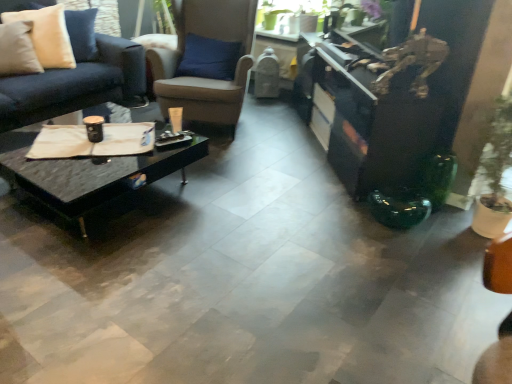
Describe the element at coordinates (47, 35) in the screenshot. The width and height of the screenshot is (512, 384). I see `beige fabric pillow at upper left` at that location.

Consider the image. Measure the distance between brown leather chair at center and camera.

The distance of brown leather chair at center from camera is 3.07 meters.

Identify the location of black glossy entertainment center at right. (373, 109).

At what (x,y) coordinates should I click in order to perform the action: click on black marble coffee table at center. Please return your answer as a coordinate pair (x, y). This screenshot has height=384, width=512. Looking at the image, I should click on (94, 176).

Does black glossy entertainment center at right have a smaller size compared to beige fabric pillow at upper left?

No.

Could you tell me if black glossy entertainment center at right is turned towards beige fabric pillow at upper left?

Yes, black glossy entertainment center at right is turned towards beige fabric pillow at upper left.

Measure the distance from black glossy entertainment center at right to beige fabric pillow at upper left.

The distance of black glossy entertainment center at right from beige fabric pillow at upper left is 2.26 meters.

Which of these two, black glossy entertainment center at right or beige fabric pillow at upper left, stands shorter?

beige fabric pillow at upper left.

Which is further, (219, 111) or (39, 41)?

Point (39, 41)

Find the location of a particular element. This screenshot has height=384, width=512. chair on the right of beige fabric pillow at upper left is located at coordinates (204, 77).

Are brown leather chair at center and beige fabric pillow at upper left making contact?

No, brown leather chair at center is not touching beige fabric pillow at upper left.

Is the position of brown leather chair at center less distant than that of beige fabric pillow at upper left?

Yes, it is in front of beige fabric pillow at upper left.

Is brown leather chair at center situated inside black marble coffee table at center or outside?

brown leather chair at center lies outside black marble coffee table at center.

Is brown leather chair at center bigger or smaller than black marble coffee table at center?

Considering their sizes, brown leather chair at center takes up more space than black marble coffee table at center.

Between brown leather chair at center and black marble coffee table at center, which one has smaller width?

brown leather chair at center.

Which is in front, brown leather chair at center or black marble coffee table at center?

Positioned in front is black marble coffee table at center.

Which is correct: black marble coffee table at center is inside beige fabric pillow at upper left, or outside of it?

black marble coffee table at center cannot be found inside beige fabric pillow at upper left.

Considering the sizes of black marble coffee table at center and beige fabric pillow at upper left in the image, is black marble coffee table at center wider or thinner than beige fabric pillow at upper left?

In the image, black marble coffee table at center appears to be wider than beige fabric pillow at upper left.

Between black marble coffee table at center and beige fabric pillow at upper left, which one appears on the right side from the viewer's perspective?

From the viewer's perspective, black marble coffee table at center appears more on the right side.

Where is `coffee table that appears below the beige fabric pillow at upper left (from a real-world perspective)`? This screenshot has width=512, height=384. coffee table that appears below the beige fabric pillow at upper left (from a real-world perspective) is located at coordinates (94, 176).

Is beige fabric pillow at upper left closer to the viewer compared to brown leather chair at center?

No.

Looking at their sizes, would you say beige fabric pillow at upper left is wider or thinner than brown leather chair at center?

In the image, beige fabric pillow at upper left appears to be more narrow than brown leather chair at center.

Is beige fabric pillow at upper left touching brown leather chair at center?

No.

Does point (5, 17) lie in front of point (401, 153)?

No, it is not.

Could you measure the distance between beige fabric pillow at upper left and black glossy entertainment center at right?

7.41 feet.

How many degrees apart are the facing directions of beige fabric pillow at upper left and black glossy entertainment center at right?

There is a 86.9-degree angle between the facing directions of beige fabric pillow at upper left and black glossy entertainment center at right.

From the picture: From the image's perspective, is beige fabric pillow at upper left beneath black glossy entertainment center at right?

Actually, beige fabric pillow at upper left appears above black glossy entertainment center at right in the image.

From a real-world perspective, which object rests below the other?

black marble coffee table at center.

Looking at the image, does black glossy entertainment center at right seem bigger or smaller compared to black marble coffee table at center?

Considering their sizes, black glossy entertainment center at right takes up more space than black marble coffee table at center.

Does black glossy entertainment center at right have a lesser width compared to black marble coffee table at center?

Correct, the width of black glossy entertainment center at right is less than that of black marble coffee table at center.

Where is `pillow located behind the black glossy entertainment center at right`? The width and height of the screenshot is (512, 384). pillow located behind the black glossy entertainment center at right is located at coordinates (47, 35).

Image resolution: width=512 pixels, height=384 pixels. Identify the location of chair in front of the beige fabric pillow at upper left. (204, 77).

From the image, which object appears to be farther from brown leather chair at center, black glossy entertainment center at right or black marble coffee table at center?

black marble coffee table at center.

Which object lies further to the anchor point black marble coffee table at center, brown leather chair at center or black glossy entertainment center at right?

Among the two, black glossy entertainment center at right is located further to black marble coffee table at center.

Based on their spatial positions, is black marble coffee table at center or beige fabric pillow at upper left closer to brown leather chair at center?

beige fabric pillow at upper left lies closer to brown leather chair at center than the other object.

Looking at this image, which object lies nearer to the anchor point black glossy entertainment center at right, black marble coffee table at center or brown leather chair at center?

brown leather chair at center is positioned closer to the anchor black glossy entertainment center at right.

Looking at the image, which one is located further to brown leather chair at center, black marble coffee table at center or black glossy entertainment center at right?

black marble coffee table at center.

Which object lies nearer to the anchor point black glossy entertainment center at right, beige fabric pillow at upper left or black marble coffee table at center?

Based on the image, black marble coffee table at center appears to be nearer to black glossy entertainment center at right.

Considering their positions, is beige fabric pillow at upper left positioned further to black marble coffee table at center than brown leather chair at center?

beige fabric pillow at upper left is positioned further to the anchor black marble coffee table at center.

Considering their positions, is black marble coffee table at center positioned closer to beige fabric pillow at upper left than black glossy entertainment center at right?

Based on the image, black marble coffee table at center appears to be nearer to beige fabric pillow at upper left.

Identify the location of chair located between black marble coffee table at center and black glossy entertainment center at right in the left-right direction. The height and width of the screenshot is (384, 512). (204, 77).

The image size is (512, 384). I want to click on coffee table between beige fabric pillow at upper left and brown leather chair at center from left to right, so click(94, 176).

This screenshot has width=512, height=384. In order to click on chair situated between beige fabric pillow at upper left and black glossy entertainment center at right from left to right in this screenshot , I will do `click(204, 77)`.

Where is `coffee table between beige fabric pillow at upper left and black glossy entertainment center at right in the horizontal direction`? This screenshot has height=384, width=512. coffee table between beige fabric pillow at upper left and black glossy entertainment center at right in the horizontal direction is located at coordinates (94, 176).